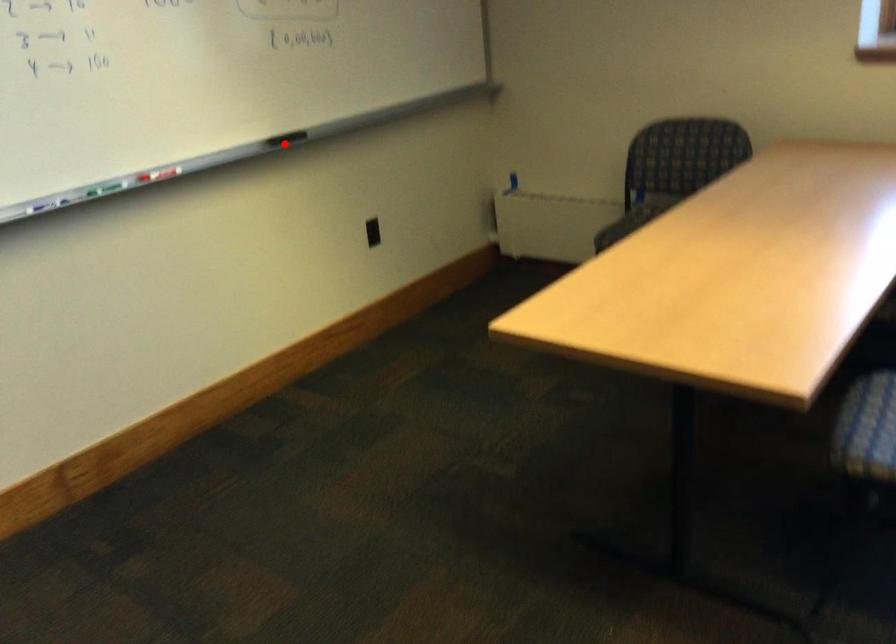
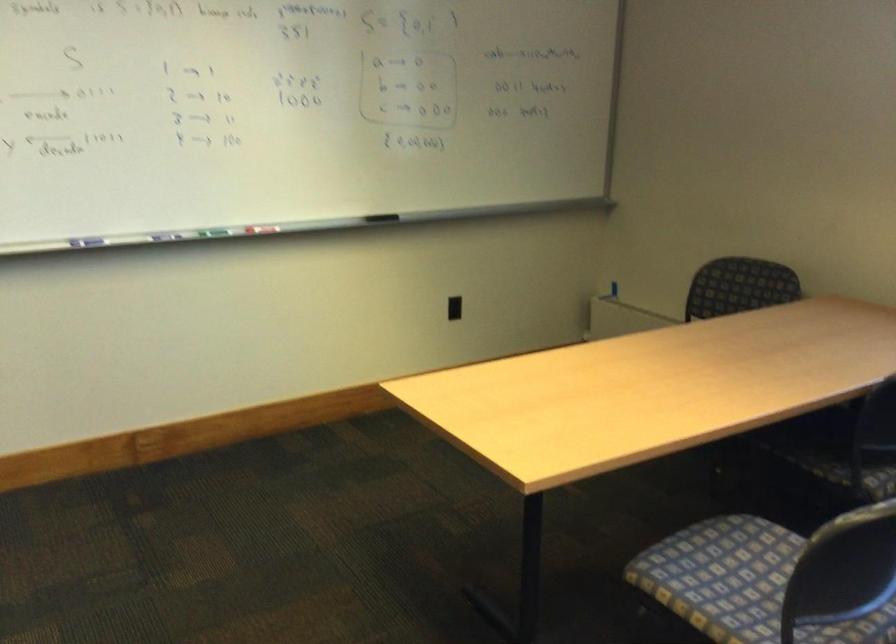
Locate, in the second image, the point that corresponds to the highlighted location in the first image.

(381, 218)